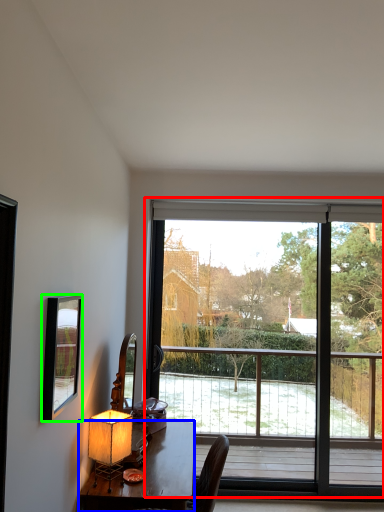
Question: Which object is the farthest from window (highlighted by a red box)? Choose among these: desk (highlighted by a blue box) or mirror (highlighted by a green box).

Choices:
 (A) desk
 (B) mirror

Answer: (B)